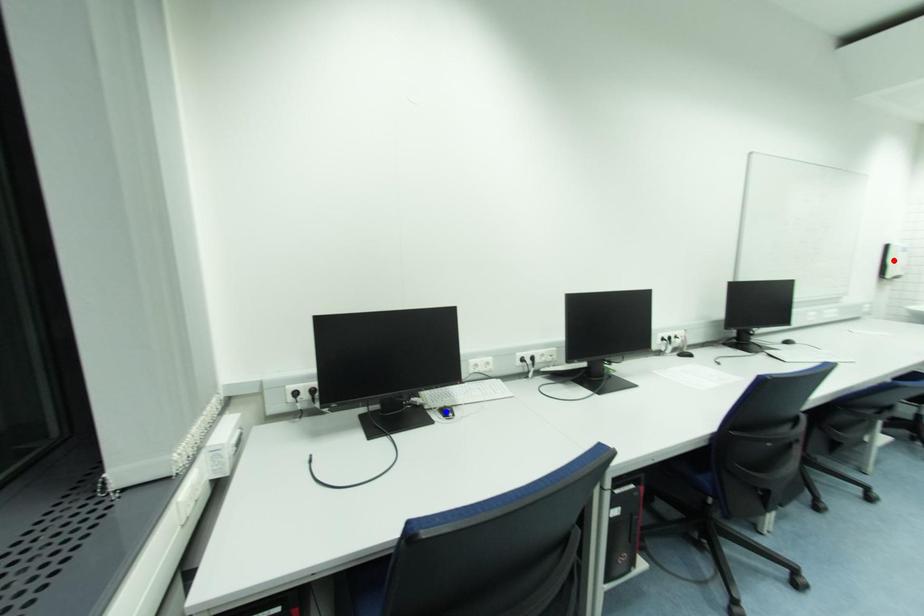
Question: Two points are marked on the image. Which point is closer to the camera?

Choices:
 (A) Blue point is closer.
 (B) Red point is closer.

Answer: (A)